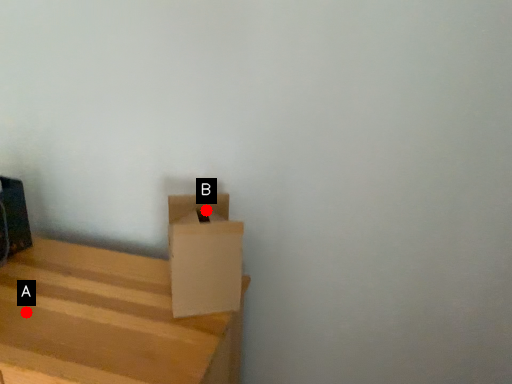
Question: Two points are circled on the image, labeled by A and B beside each circle. Among these points, which one is nearest to the camera?

Choices:
 (A) A is closer
 (B) B is closer

Answer: (A)